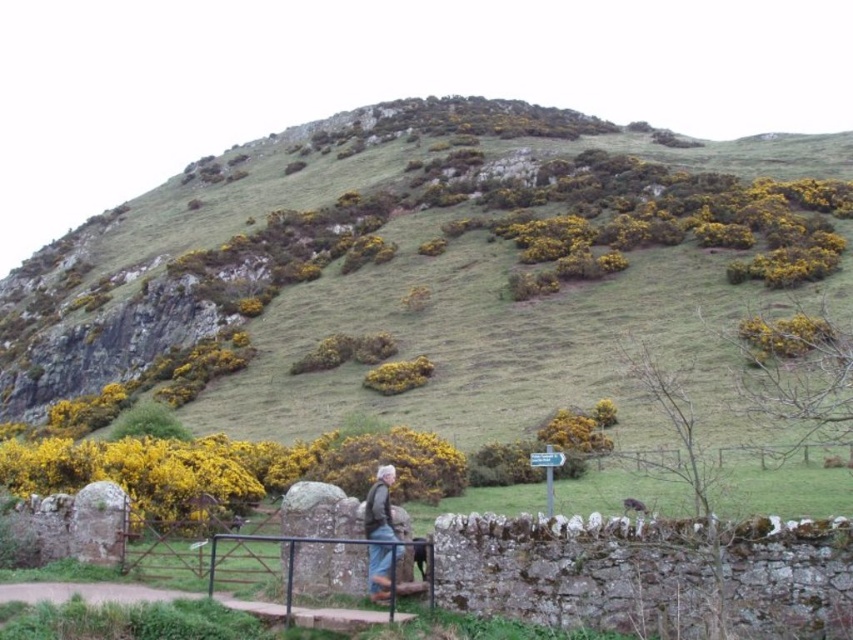
You are a hiker who wants to take a photo of the green grassy hillside at upper center and the denim jacket at lower center. Which object should you focus on first if you want to capture both in a single frame without moving the camera?

You should focus on the green grassy hillside at upper center first because it is larger in size than the denim jacket at lower center, allowing you to frame it properly while ensuring the smaller denim jacket at lower center remains in the shot.

Looking at this image, you are standing on the grassy hillside and want to walk from the metal gate to the stone wall. Which point, point (279,269) or point (379,480), is closer to you as you start walking?

Point (279,269) is closer to you because it is further to the viewer than point (379,480).